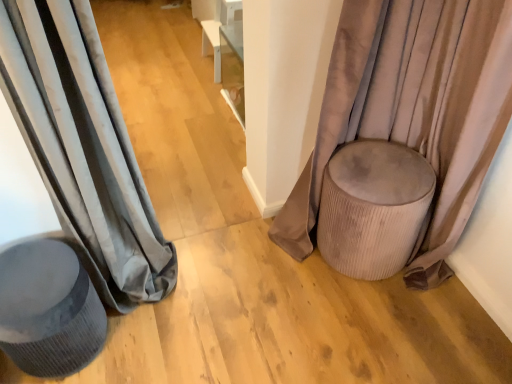
Identify the location of vacant space situated on the left part of velvet beige pouf at right, the 2th curtain viewed from the left. The height and width of the screenshot is (384, 512). (240, 256).